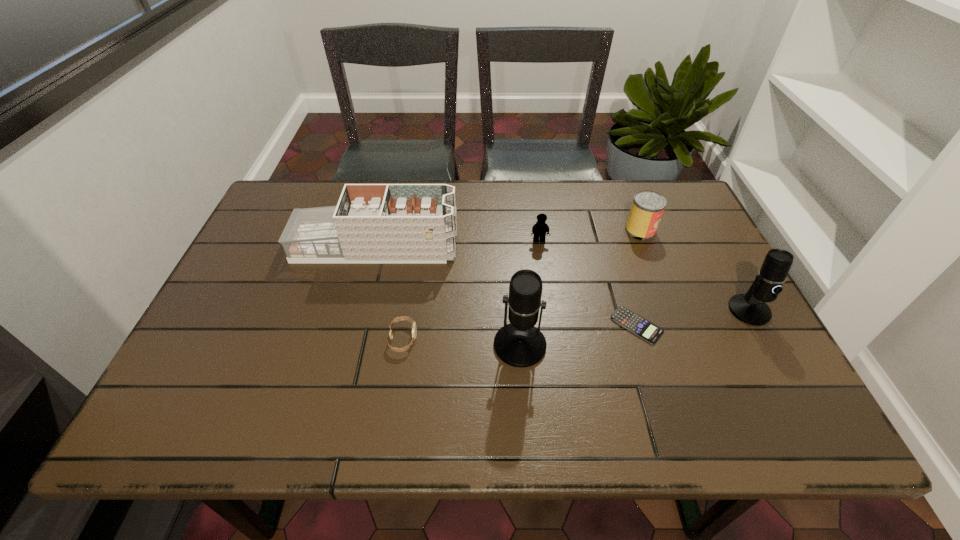
The height and width of the screenshot is (540, 960). I want to click on blank space that satisfies the following two spatial constraints: 1. on the front-facing side of the shortest object; 2. on the right side of the Lego, so click(551, 326).

You are a GUI agent. You are given a task and a screenshot of the screen. Output one action in this format:
    pyautogui.click(x=<x>, y=<y>)
    Task: Click on the vacant space that satisfies the following two spatial constraints: 1. on the back side of the rightmost object; 2. at the entrance of the dollhouse
    The image size is (960, 540).
    Given the screenshot: What is the action you would take?
    pyautogui.click(x=714, y=247)

Where is `free space that satisfies the following two spatial constraints: 1. at the entrance of the dollhouse; 2. on the left side of the shorter microphone`? This screenshot has width=960, height=540. free space that satisfies the following two spatial constraints: 1. at the entrance of the dollhouse; 2. on the left side of the shorter microphone is located at coordinates (360, 310).

Find the location of a particular element. vacant space that satisfies the following two spatial constraints: 1. at the entrance of the dollhouse; 2. on the left side of the shortest object is located at coordinates (356, 326).

Find the location of `free region that satisfies the following two spatial constraints: 1. on the front-facing side of the fifth tallest object; 2. at the entrance of the dollhouse`. free region that satisfies the following two spatial constraints: 1. on the front-facing side of the fifth tallest object; 2. at the entrance of the dollhouse is located at coordinates (540, 247).

This screenshot has height=540, width=960. Identify the location of free space in the image that satisfies the following two spatial constraints: 1. on the face of the watch; 2. on the right side of the tallest object. (402, 345).

The height and width of the screenshot is (540, 960). What are the coordinates of `vacant space that satisfies the following two spatial constraints: 1. on the face of the taller microphone; 2. on the right side of the watch` in the screenshot? It's located at (402, 345).